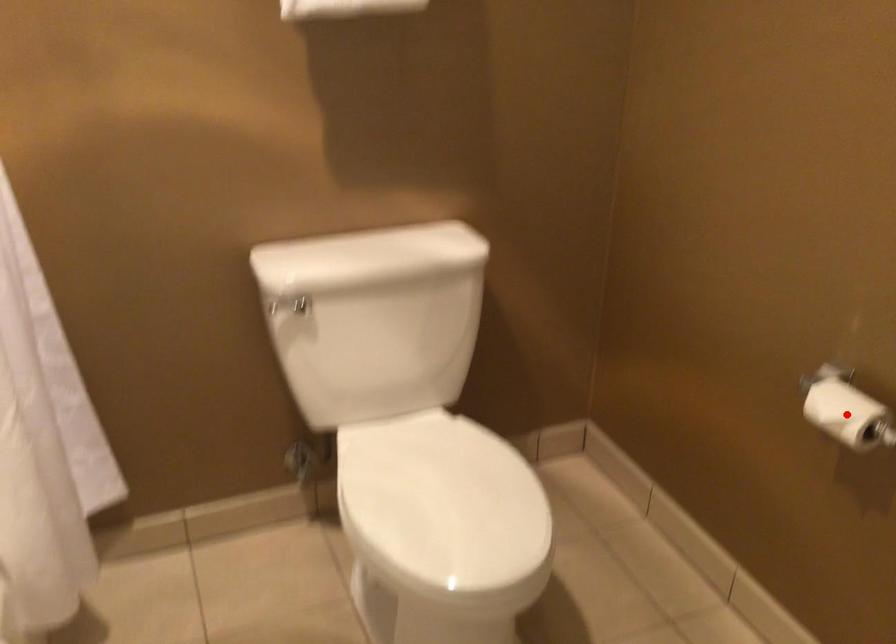
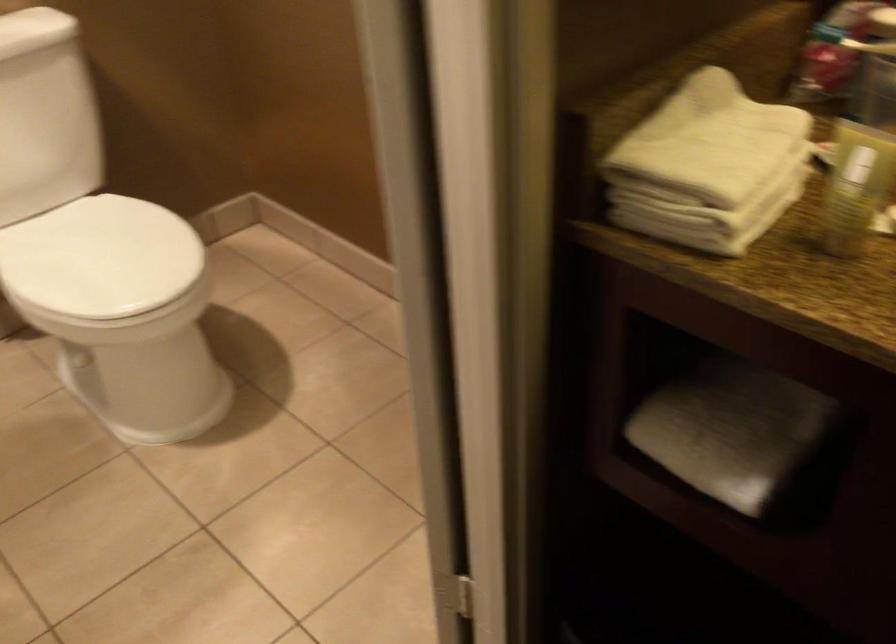
Question: I am providing you with two images of the same scene from different viewpoints. A red point is marked on the first image. Is the red point's position out of view in image 2?

Choices:
 (A) Yes
 (B) No

Answer: (A)